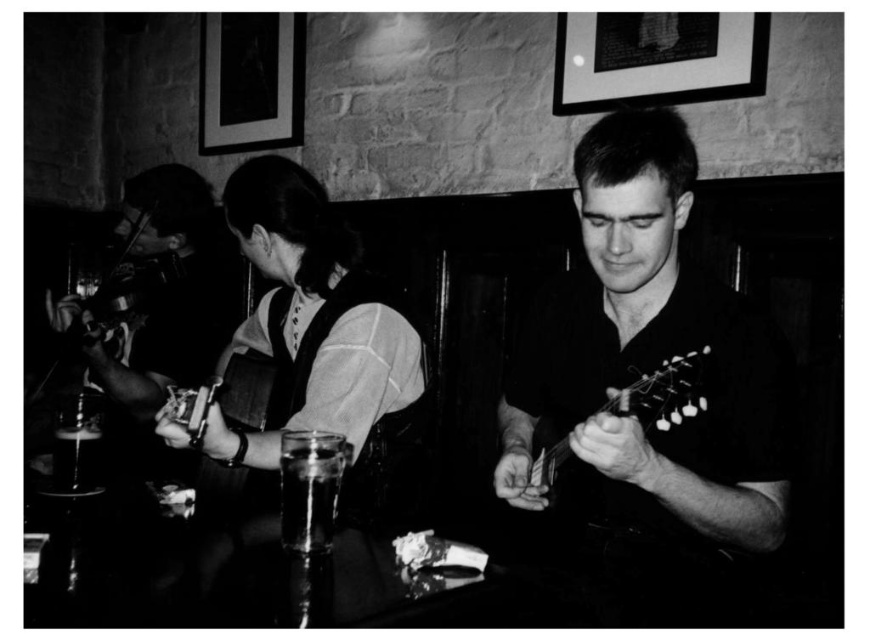
Question: Which of the following is the closest to the observer?

Choices:
 (A) translucent glass at lower left
 (B) smooth wood violin at left
 (C) metallic silver guitar at center
 (D) clear glass at center

Answer: (C)

Question: Does black matte guitar at center have a lesser width compared to smooth wood violin at left?

Choices:
 (A) no
 (B) yes

Answer: (A)

Question: Where is smooth wood violin at left located in relation to metallic silver guitar at center in the image?

Choices:
 (A) above
 (B) below

Answer: (A)

Question: Which point is farther to the camera?

Choices:
 (A) clear glass at center
 (B) black matte guitar at center
 (C) metallic silver guitar at center

Answer: (A)

Question: Which object is positioned closest to the smooth wood violin at left?

Choices:
 (A) metallic silver guitar at center
 (B) clear glass at center

Answer: (B)

Question: Is black matte guitar at center wider than metallic silver guitar at center?

Choices:
 (A) no
 (B) yes

Answer: (B)